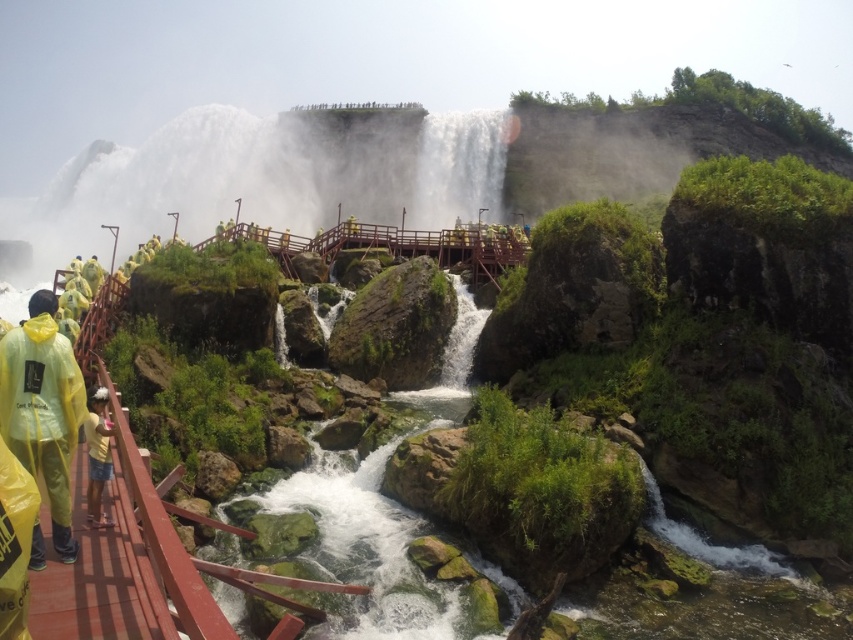
You are standing on the walkway at the waterfall and want to take a photo of the yellow translucent raincoat at lower left and yellow matte shorts at lower left. Which object should you focus on first if you want to capture both in the same frame without moving the camera?

You should focus on the yellow translucent raincoat at lower left first because it is to the left of the yellow matte shorts at lower left, so keeping it centered initially allows the shorts to come into frame as you adjust slightly without moving the camera.

You are a photographer positioned on the red wooden walkway at the waterfall. You notice two items of clothing at the lower left corner of your camera frame. The items are the yellow translucent raincoat at lower left and the yellow matte shorts at lower left. Which clothing item is wider in the frame?

The yellow translucent raincoat at lower left is wider than the yellow matte shorts at lower left in the frame.

You are standing on the red wooden walkway and notice two yellow items at lower left. Which one is nearer to you, the yellow translucent raincoat at lower left or the yellow matte shorts at lower left?

The yellow translucent raincoat at lower left is closer to the viewer than the yellow matte shorts at lower left.